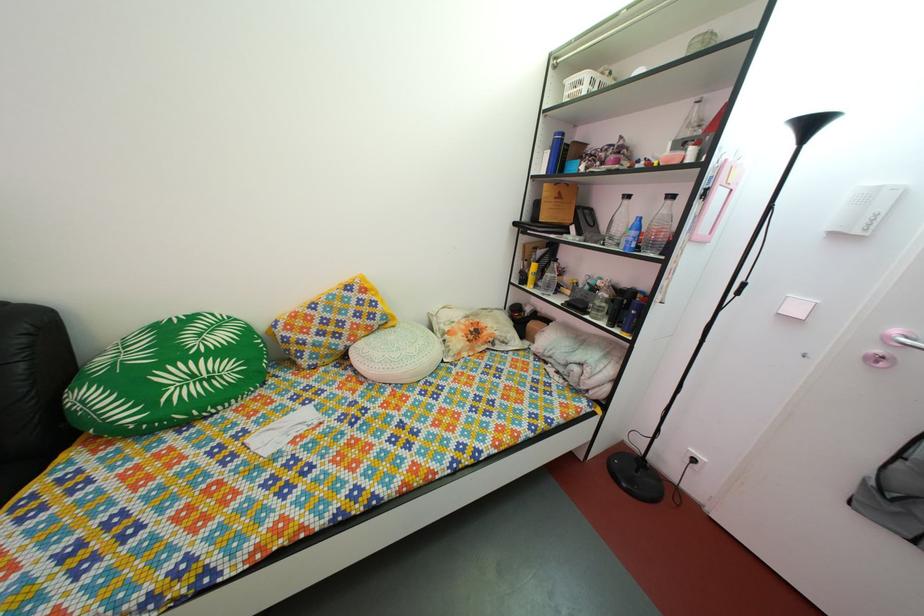
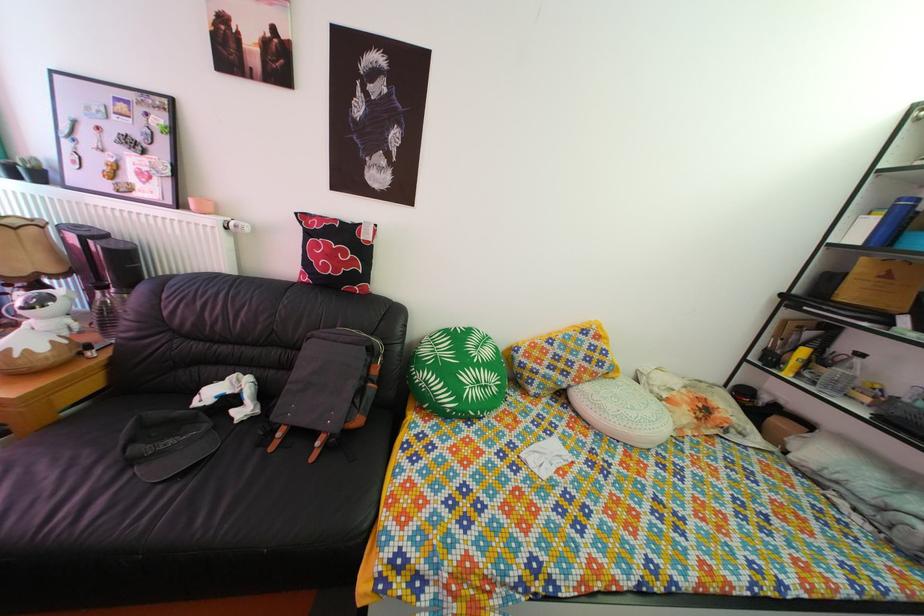
Question: How did the camera likely rotate?

Choices:
 (A) Left
 (B) Right
 (C) Up
 (D) Down

Answer: (A)